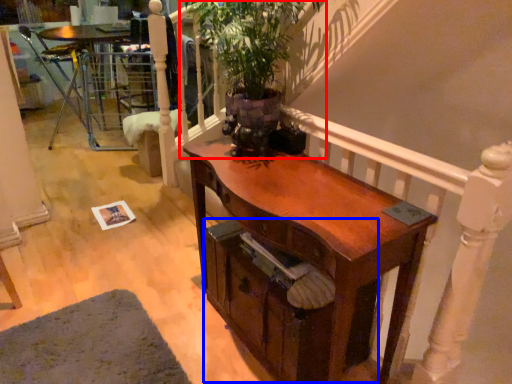
Question: Which point is closer to the camera, houseplant (highlighted by a red box) or drawer (highlighted by a blue box)?

Choices:
 (A) houseplant
 (B) drawer

Answer: (A)